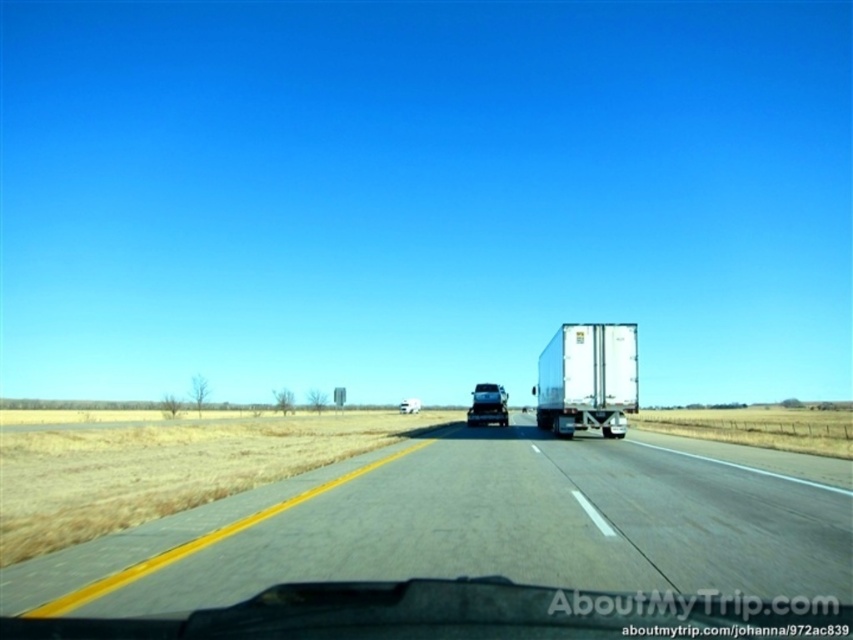
Can you confirm if gray asphalt highway at center is positioned to the right of white matte truck at center?

Correct, you'll find gray asphalt highway at center to the right of white matte truck at center.

Does gray asphalt highway at center have a smaller size compared to white matte truck at center?

Yes, gray asphalt highway at center is smaller than white matte truck at center.

Is point (311, 502) more distant than point (404, 406)?

No, it is in front of (404, 406).

You are a GUI agent. You are given a task and a screenshot of the screen. Output one action in this format:
    pyautogui.click(x=<x>, y=<y>)
    Task: Click on the gray asphalt highway at center
    The image size is (853, 640).
    Given the screenshot: What is the action you would take?
    pyautogui.click(x=480, y=525)

Can you confirm if glossy black truck at center is positioned below white matte truck at center?

Actually, glossy black truck at center is above white matte truck at center.

Which is more to the left, glossy black truck at center or white matte truck at center?

Positioned to the left is white matte truck at center.

Is point (477, 412) farther from viewer compared to point (418, 404)?

That is False.

You are a GUI agent. You are given a task and a screenshot of the screen. Output one action in this format:
    pyautogui.click(x=<x>, y=<y>)
    Task: Click on the glossy black truck at center
    
    Given the screenshot: What is the action you would take?
    pyautogui.click(x=486, y=404)

At what (x,y) coordinates should I click in order to perform the action: click on white glossy trailer truck at center. Please return your answer as a coordinate pair (x, y). Looking at the image, I should click on (587, 380).

Does white glossy trailer truck at center come in front of glossy black truck at center?

That is True.

At what (x,y) coordinates should I click in order to perform the action: click on white glossy trailer truck at center. Please return your answer as a coordinate pair (x, y). Looking at the image, I should click on (587, 380).